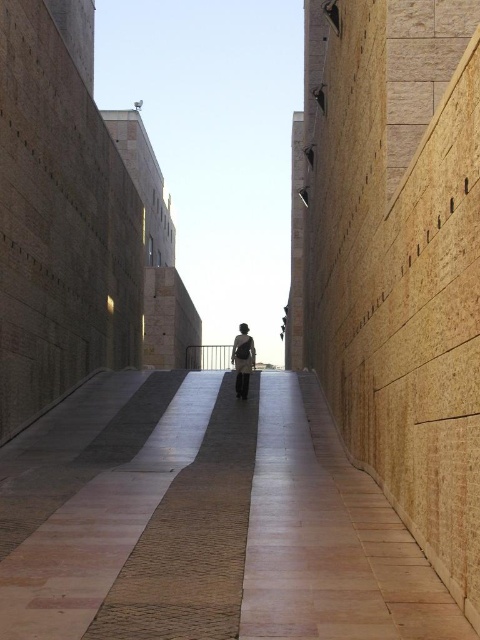
Question: Which point appears farthest from the camera in this image?

Choices:
 (A) (236, 339)
 (B) (4, 544)

Answer: (A)

Question: Is polished stone pavement at center to the right of white fabric dress at center from the viewer's perspective?

Choices:
 (A) yes
 (B) no

Answer: (B)

Question: Does polished stone pavement at center appear under white fabric dress at center?

Choices:
 (A) yes
 (B) no

Answer: (A)

Question: Which of the following is the farthest from the observer?

Choices:
 (A) polished stone pavement at center
 (B) white fabric dress at center

Answer: (B)

Question: Is polished stone pavement at center positioned at the back of white fabric dress at center?

Choices:
 (A) yes
 (B) no

Answer: (B)